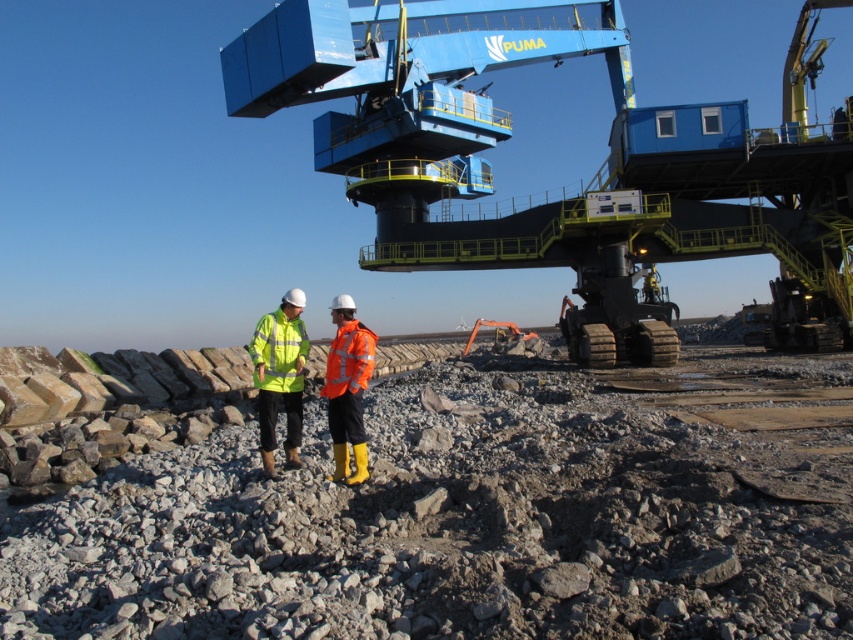
Based on the photo, you are a safety inspector at the industrial site. You notice two points marked on your map at coordinates point (x=579, y=593) and point (x=271, y=387). Based on the image, which point is closer to the safety inspector standing at the entrance?

Point (x=579, y=593) is in front of point (x=271, y=387), so it is closer to the safety inspector standing at the entrance.